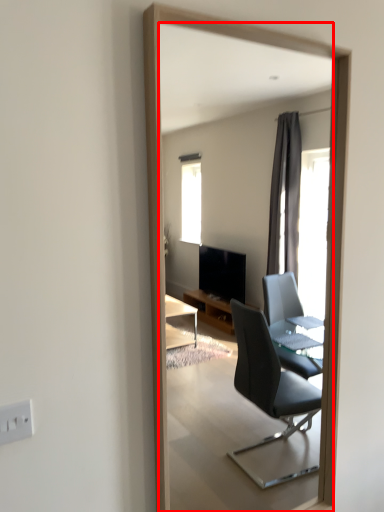
Question: Considering the relative positions of mirror (annotated by the red box) and electric outlet in the image provided, where is mirror (annotated by the red box) located with respect to the staircase?

Choices:
 (A) right
 (B) left

Answer: (A)